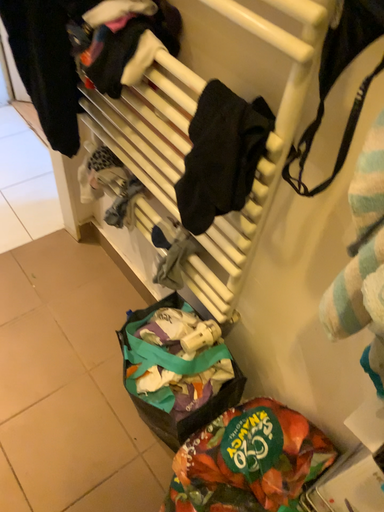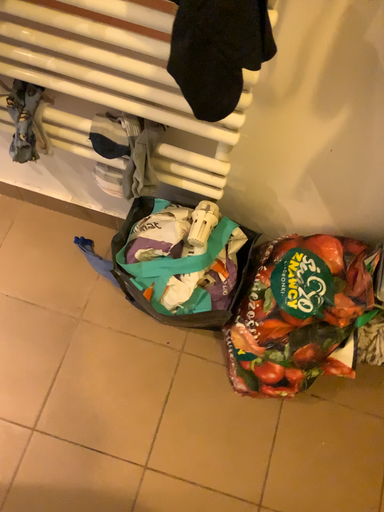
Question: Which way did the camera rotate in the video?

Choices:
 (A) rotated downward
 (B) rotated upward

Answer: (A)